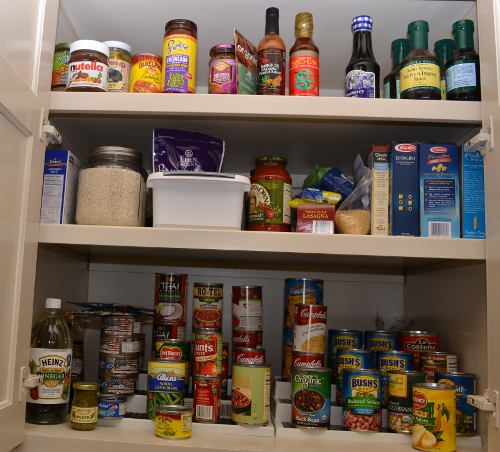
This screenshot has width=500, height=452. Identify the location of boxes. (469, 169), (442, 169), (411, 170), (378, 181), (320, 226), (55, 197).